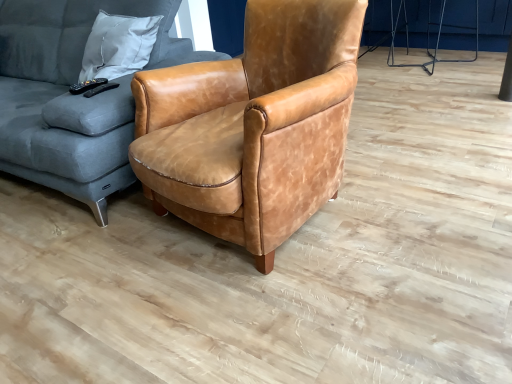
What do you see at coordinates (253, 125) in the screenshot? I see `matte brown leather armchair at center` at bounding box center [253, 125].

Locate an element on the screen. velvet grey couch at left is located at coordinates tap(72, 96).

Is point (406, 22) less distant than point (183, 186)?

No.

Is metallic silver tripod at upper right in front of or behind matte brown leather armchair at center in the image?

Visually, metallic silver tripod at upper right is located behind matte brown leather armchair at center.

What's the angular difference between metallic silver tripod at upper right and matte brown leather armchair at center's facing directions?

metallic silver tripod at upper right and matte brown leather armchair at center are facing 173 degrees away from each other.

What are the coordinates of `chair below the metallic silver tripod at upper right (from the image's perspective)` in the screenshot? It's located at (253, 125).

Are matte brown leather armchair at center and velvet grey couch at left far apart?

matte brown leather armchair at center is actually quite close to velvet grey couch at left.

Is matte brown leather armchair at center wider or thinner than velvet grey couch at left?

Considering their sizes, matte brown leather armchair at center looks slimmer than velvet grey couch at left.

Could you tell me if matte brown leather armchair at center is facing velvet grey couch at left?

No, matte brown leather armchair at center is not facing towards velvet grey couch at left.

From a real-world perspective, between matte brown leather armchair at center and velvet grey couch at left, who is vertically lower?

In real-world perspective, matte brown leather armchair at center is lower.

Looking at this image, can you confirm if velvet grey couch at left is bigger than matte brown leather armchair at center?

Correct, velvet grey couch at left is larger in size than matte brown leather armchair at center.

Can you tell me how much velvet grey couch at left and matte brown leather armchair at center differ in facing direction?

velvet grey couch at left and matte brown leather armchair at center are facing 13.3 degrees away from each other.

Between point (40, 19) and point (243, 76), which one is positioned behind?

The point (40, 19) is farther.

Is velvet grey couch at left turned away from matte brown leather armchair at center?

No, velvet grey couch at left is not facing the opposite direction of matte brown leather armchair at center.

Which is in front, point (45, 126) or point (429, 1)?

The point (45, 126) is closer.

From a real-world perspective, is velvet grey couch at left physically above metallic silver tripod at upper right?

Yes, from a real-world perspective, velvet grey couch at left is on top of metallic silver tripod at upper right.

Can you confirm if velvet grey couch at left is wider than metallic silver tripod at upper right?

Indeed, velvet grey couch at left has a greater width compared to metallic silver tripod at upper right.

Considering the points (392, 30) and (183, 58), which point is in front, point (392, 30) or point (183, 58)?

Positioned in front is point (183, 58).

Is metallic silver tripod at upper right in front of or behind velvet grey couch at left in the image?

metallic silver tripod at upper right is behind velvet grey couch at left.

Which of these two, metallic silver tripod at upper right or velvet grey couch at left, is smaller?

Smaller between the two is metallic silver tripod at upper right.

Does metallic silver tripod at upper right have a greater height compared to velvet grey couch at left?

Incorrect, the height of metallic silver tripod at upper right is not larger of that of velvet grey couch at left.

How much distance is there between matte brown leather armchair at center and metallic silver tripod at upper right?

The distance of matte brown leather armchair at center from metallic silver tripod at upper right is 2.32 meters.

Are matte brown leather armchair at center and metallic silver tripod at upper right far apart?

Absolutely, matte brown leather armchair at center is distant from metallic silver tripod at upper right.

Based on the photo, from a real-world perspective, is matte brown leather armchair at center under metallic silver tripod at upper right?

Incorrect, from a real-world perspective, matte brown leather armchair at center is higher than metallic silver tripod at upper right.

Which point is more forward, (269, 38) or (394, 44)?

Point (269, 38)

The width and height of the screenshot is (512, 384). Find the location of `chair on the left of metallic silver tripod at upper right`. chair on the left of metallic silver tripod at upper right is located at coordinates (253, 125).

The width and height of the screenshot is (512, 384). In order to click on studio couch lying behind the matte brown leather armchair at center in this screenshot , I will do `click(72, 96)`.

Looking at the image, which one is located further to matte brown leather armchair at center, metallic silver tripod at upper right or velvet grey couch at left?

metallic silver tripod at upper right.

When comparing their distances from metallic silver tripod at upper right, does matte brown leather armchair at center or velvet grey couch at left seem further?

velvet grey couch at left lies further to metallic silver tripod at upper right than the other object.

Which object lies nearer to the anchor point metallic silver tripod at upper right, velvet grey couch at left or matte brown leather armchair at center?

matte brown leather armchair at center is positioned closer to the anchor metallic silver tripod at upper right.

Looking at this image, looking at the image, which one is located closer to velvet grey couch at left, matte brown leather armchair at center or metallic silver tripod at upper right?

Among the two, matte brown leather armchair at center is located nearer to velvet grey couch at left.

Considering their positions, is velvet grey couch at left positioned further to matte brown leather armchair at center than metallic silver tripod at upper right?

Based on the image, metallic silver tripod at upper right appears to be further to matte brown leather armchair at center.

Considering their positions, is metallic silver tripod at upper right positioned further to velvet grey couch at left than matte brown leather armchair at center?

metallic silver tripod at upper right lies further to velvet grey couch at left than the other object.

Find the location of a particular element. Image resolution: width=512 pixels, height=384 pixels. chair between velvet grey couch at left and metallic silver tripod at upper right from left to right is located at coordinates (x=253, y=125).